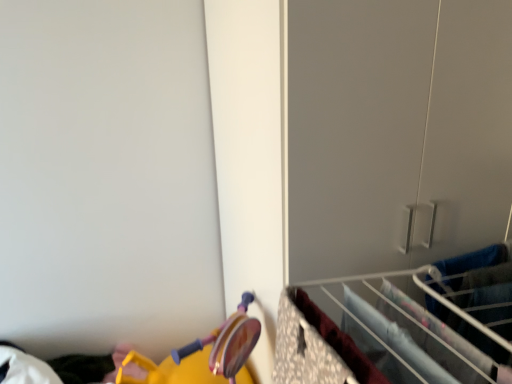
This screenshot has width=512, height=384. What do you see at coordinates (401, 326) in the screenshot? I see `metal wire rack at lower right, the first closet when ordered from left to right` at bounding box center [401, 326].

Describe the element at coordinates (396, 132) in the screenshot. Image resolution: width=512 pixels, height=384 pixels. I see `matte gray closet at center-right, the 1th closet when ordered from top to bottom` at that location.

You are a GUI agent. You are given a task and a screenshot of the screen. Output one action in this format:
    pyautogui.click(x=<x>, y=<y>)
    Task: Click on the metal wire rack at lower right, marked as the second closet in a top-to-bottom arrangement
    The height and width of the screenshot is (384, 512).
    Given the screenshot: What is the action you would take?
    pyautogui.click(x=401, y=326)

Looking at the image, does metal wire rack at lower right, the first closet when ordered from left to right, seem bigger or smaller compared to matte gray closet at center-right, the second closet from the left?

Clearly, metal wire rack at lower right, the first closet when ordered from left to right, is smaller in size than matte gray closet at center-right, the second closet from the left.

Considering the relative sizes of metal wire rack at lower right, marked as the second closet in a top-to-bottom arrangement, and matte gray closet at center-right, acting as the 2th closet starting from the bottom, in the image provided, is metal wire rack at lower right, marked as the second closet in a top-to-bottom arrangement, thinner than matte gray closet at center-right, acting as the 2th closet starting from the bottom,?

Yes, metal wire rack at lower right, marked as the second closet in a top-to-bottom arrangement, is thinner than matte gray closet at center-right, acting as the 2th closet starting from the bottom.

Where is `closet below the matte gray closet at center-right, the 1th closet when ordered from top to bottom (from the image's perspective)`? Image resolution: width=512 pixels, height=384 pixels. closet below the matte gray closet at center-right, the 1th closet when ordered from top to bottom (from the image's perspective) is located at coordinates (401, 326).

How many degrees apart are the facing directions of metal wire rack at lower right, marked as the second closet in a top-to-bottom arrangement, and matte gray closet at center-right, acting as the 2th closet starting from the bottom?

0.111 degrees separate the facing orientations of metal wire rack at lower right, marked as the second closet in a top-to-bottom arrangement, and matte gray closet at center-right, acting as the 2th closet starting from the bottom.

From the image's perspective, who appears lower, floral fabric drawer at lower right or matte gray closet at center-right, the second closet from the left?

From the image's view, floral fabric drawer at lower right is below.

What's the angular difference between floral fabric drawer at lower right and matte gray closet at center-right, the first closet in the right-to-left sequence,'s facing directions?

The facing directions of floral fabric drawer at lower right and matte gray closet at center-right, the first closet in the right-to-left sequence, are 0.111 degrees apart.

Is floral fabric drawer at lower right at the right side of matte gray closet at center-right, the first closet in the right-to-left sequence?

No.

Considering the relative sizes of floral fabric drawer at lower right and matte gray closet at center-right, acting as the 2th closet starting from the bottom, in the image provided, is floral fabric drawer at lower right bigger than matte gray closet at center-right, acting as the 2th closet starting from the bottom,?

No, floral fabric drawer at lower right is not bigger than matte gray closet at center-right, acting as the 2th closet starting from the bottom.

Which of these two, metal wire rack at lower right, the 2th closet from the right, or floral fabric drawer at lower right, is thinner?

floral fabric drawer at lower right.

Does metal wire rack at lower right, marked as the second closet in a top-to-bottom arrangement, come in front of floral fabric drawer at lower right?

No, it is not.

Considering the positions of objects metal wire rack at lower right, the first closet ordered from the bottom, and floral fabric drawer at lower right in the image provided, who is more to the right, metal wire rack at lower right, the first closet ordered from the bottom, or floral fabric drawer at lower right?

metal wire rack at lower right, the first closet ordered from the bottom, is more to the right.

What's the angular difference between matte gray closet at center-right, the first closet in the right-to-left sequence, and metal wire rack at lower right, the first closet ordered from the bottom,'s facing directions?

The facing directions of matte gray closet at center-right, the first closet in the right-to-left sequence, and metal wire rack at lower right, the first closet ordered from the bottom, are 0.111 degrees apart.

Between matte gray closet at center-right, the second closet from the left, and metal wire rack at lower right, the first closet when ordered from left to right, which one is positioned in front?

metal wire rack at lower right, the first closet when ordered from left to right, is closer to the camera.

Can you confirm if matte gray closet at center-right, the first closet in the right-to-left sequence, is smaller than metal wire rack at lower right, the first closet when ordered from left to right?

Actually, matte gray closet at center-right, the first closet in the right-to-left sequence, might be larger than metal wire rack at lower right, the first closet when ordered from left to right.

In the scene shown: Is matte gray closet at center-right, the 1th closet when ordered from top to bottom, not inside metal wire rack at lower right, the first closet when ordered from left to right?

Indeed, matte gray closet at center-right, the 1th closet when ordered from top to bottom, is completely outside metal wire rack at lower right, the first closet when ordered from left to right.

From the image's perspective, which closet is the 2nd one above the floral fabric drawer at lower right? Please provide its 2D coordinates.

[(396, 132)]

Is point (484, 106) closer or farther from the camera than point (321, 353)?

Clearly, point (484, 106) is more distant from the camera than point (321, 353).

Can you confirm if matte gray closet at center-right, the 1th closet when ordered from top to bottom, is thinner than floral fabric drawer at lower right?

Incorrect, the width of matte gray closet at center-right, the 1th closet when ordered from top to bottom, is not less than that of floral fabric drawer at lower right.

From the image's perspective, is matte gray closet at center-right, acting as the 2th closet starting from the bottom, located above floral fabric drawer at lower right?

Yes, from the image's perspective, matte gray closet at center-right, acting as the 2th closet starting from the bottom, is above floral fabric drawer at lower right.

Between floral fabric drawer at lower right and metal wire rack at lower right, the 2th closet from the right, which one has smaller width?

Thinner between the two is floral fabric drawer at lower right.

Is floral fabric drawer at lower right positioned behind metal wire rack at lower right, the 2th closet from the right?

No, floral fabric drawer at lower right is in front of metal wire rack at lower right, the 2th closet from the right.

Considering the sizes of objects floral fabric drawer at lower right and metal wire rack at lower right, the first closet when ordered from left to right, in the image provided, who is shorter, floral fabric drawer at lower right or metal wire rack at lower right, the first closet when ordered from left to right,?

metal wire rack at lower right, the first closet when ordered from left to right, is shorter.

Is point (315, 375) closer or farther from the camera than point (458, 258)?

Point (315, 375) is closer to the camera than point (458, 258).

Find the location of a particular element. closet below the matte gray closet at center-right, the first closet in the right-to-left sequence (from the image's perspective) is located at coordinates (401, 326).

This screenshot has height=384, width=512. Find the location of `drawer in front of the matte gray closet at center-right, acting as the 2th closet starting from the bottom`. drawer in front of the matte gray closet at center-right, acting as the 2th closet starting from the bottom is located at coordinates (304, 350).

When comparing their distances from matte gray closet at center-right, the 1th closet when ordered from top to bottom, does floral fabric drawer at lower right or metal wire rack at lower right, the first closet ordered from the bottom, seem further?

Among the two, floral fabric drawer at lower right is located further to matte gray closet at center-right, the 1th closet when ordered from top to bottom.

Based on their spatial positions, is metal wire rack at lower right, the first closet when ordered from left to right, or matte gray closet at center-right, acting as the 2th closet starting from the bottom, further from floral fabric drawer at lower right?

matte gray closet at center-right, acting as the 2th closet starting from the bottom.

Looking at the image, which one is located further to metal wire rack at lower right, the 2th closet from the right, floral fabric drawer at lower right or matte gray closet at center-right, the 1th closet when ordered from top to bottom?

The object further to metal wire rack at lower right, the 2th closet from the right, is matte gray closet at center-right, the 1th closet when ordered from top to bottom.

When comparing their distances from floral fabric drawer at lower right, does matte gray closet at center-right, the first closet in the right-to-left sequence, or metal wire rack at lower right, the 2th closet from the right, seem closer?

metal wire rack at lower right, the 2th closet from the right.

When comparing their distances from metal wire rack at lower right, the first closet ordered from the bottom, does matte gray closet at center-right, acting as the 2th closet starting from the bottom, or floral fabric drawer at lower right seem further?

The object further to metal wire rack at lower right, the first closet ordered from the bottom, is matte gray closet at center-right, acting as the 2th closet starting from the bottom.

From the image, which object appears to be farther from matte gray closet at center-right, acting as the 2th closet starting from the bottom, metal wire rack at lower right, the first closet ordered from the bottom, or floral fabric drawer at lower right?

The object further to matte gray closet at center-right, acting as the 2th closet starting from the bottom, is floral fabric drawer at lower right.

Locate an element on the screen. This screenshot has height=384, width=512. closet between floral fabric drawer at lower right and matte gray closet at center-right, the second closet from the left, from left to right is located at coordinates (401, 326).